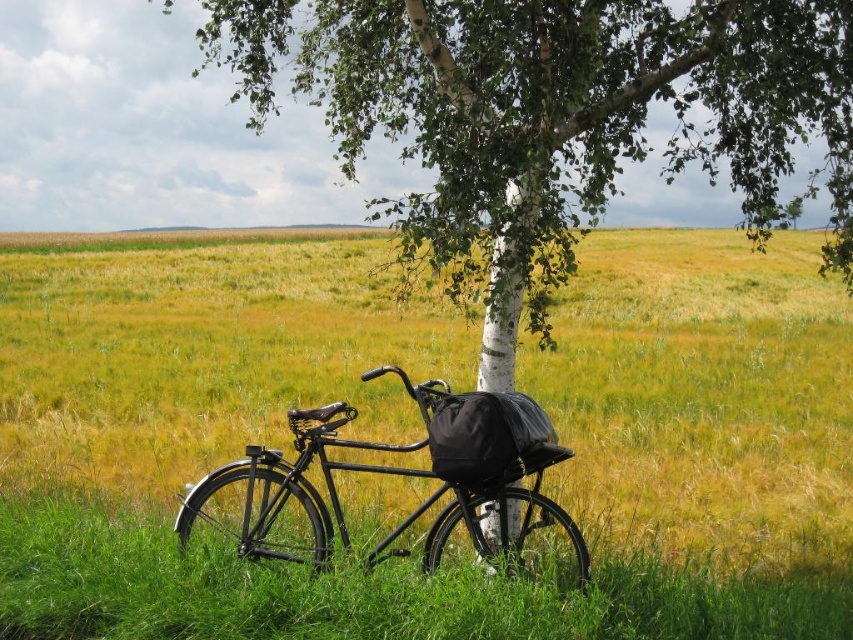
Question: Which object appears farthest from the camera in this image?

Choices:
 (A) black matte bicycle at center
 (B) white bark tree at center

Answer: (A)

Question: Which point is farther to the camera?

Choices:
 (A) white bark tree at center
 (B) black matte bicycle at center

Answer: (B)

Question: Which point is farther from the camera taking this photo?

Choices:
 (A) (587, 38)
 (B) (428, 557)

Answer: (B)

Question: Is white bark tree at center positioned at the back of black matte bicycle at center?

Choices:
 (A) no
 (B) yes

Answer: (A)

Question: Does white bark tree at center appear under black matte bicycle at center?

Choices:
 (A) no
 (B) yes

Answer: (A)

Question: Is white bark tree at center behind black matte bicycle at center?

Choices:
 (A) no
 (B) yes

Answer: (A)